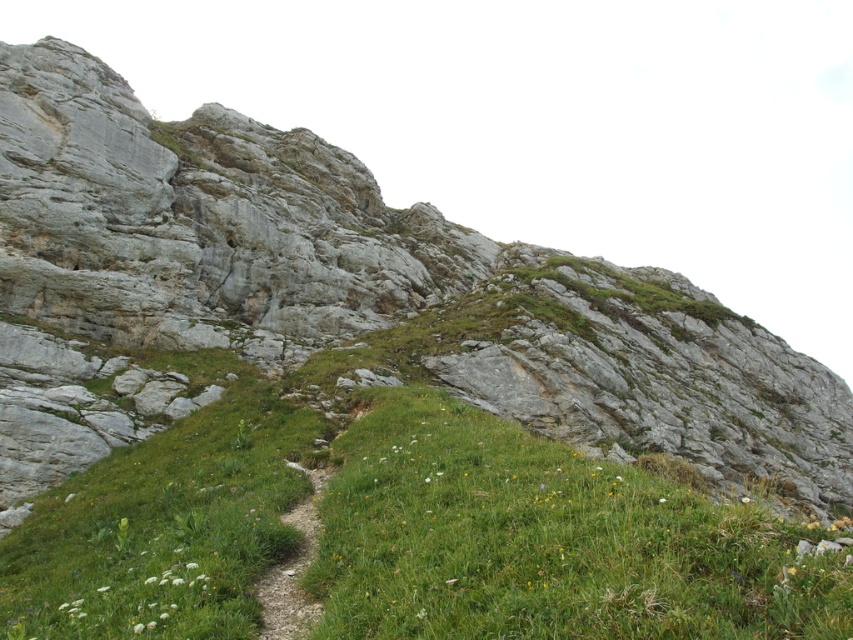
Does point (334, 502) come farther from viewer compared to point (103, 592)?

Yes, it is.

Is green grassy at center wider than white fluffy flower at lower left?

Correct, the width of green grassy at center exceeds that of white fluffy flower at lower left.

Measure the distance between point [549,484] and camera.

Point [549,484] and camera are 69.69 feet apart from each other.

What are the coordinates of `green grassy at center` in the screenshot? It's located at (546, 541).